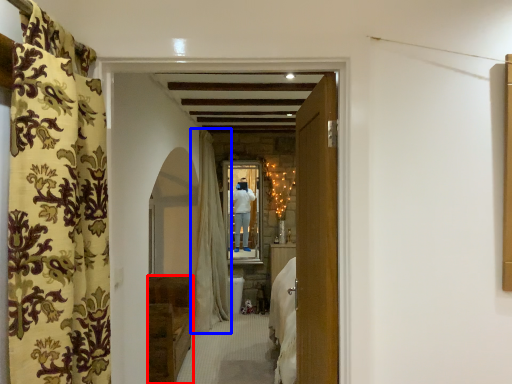
Question: Which point is further to the camera, furniture (highlighted by a red box) or curtain (highlighted by a blue box)?

Choices:
 (A) furniture
 (B) curtain

Answer: (B)